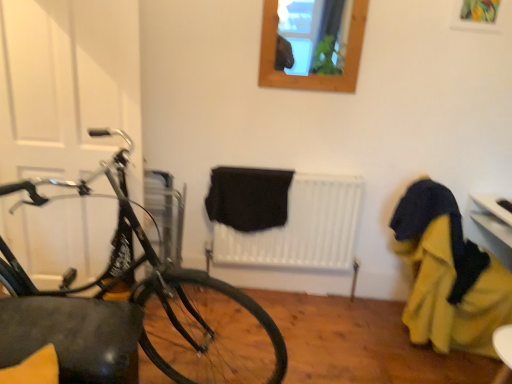
Question: From the image's perspective, is black matte radiator at center under wooden frame at upper center?

Choices:
 (A) no
 (B) yes

Answer: (B)

Question: From a real-world perspective, is black matte radiator at center under wooden frame at upper center?

Choices:
 (A) yes
 (B) no

Answer: (A)

Question: Can you confirm if black matte radiator at center is bigger than wooden frame at upper center?

Choices:
 (A) no
 (B) yes

Answer: (B)

Question: Does black matte radiator at center have a lesser height compared to wooden frame at upper center?

Choices:
 (A) yes
 (B) no

Answer: (B)

Question: Could you tell me if black matte radiator at center is turned towards wooden frame at upper center?

Choices:
 (A) yes
 (B) no

Answer: (B)

Question: Is wooden frame at upper center inside or outside of shiny black bicycle at left?

Choices:
 (A) outside
 (B) inside

Answer: (A)

Question: Based on their sizes in the image, would you say wooden frame at upper center is bigger or smaller than shiny black bicycle at left?

Choices:
 (A) small
 (B) big

Answer: (A)

Question: Is wooden frame at upper center taller or shorter than shiny black bicycle at left?

Choices:
 (A) tall
 (B) short

Answer: (B)

Question: Looking at their shapes, would you say wooden frame at upper center is wider or thinner than shiny black bicycle at left?

Choices:
 (A) thin
 (B) wide

Answer: (A)

Question: In the image, is white matte door at left positioned in front of or behind yellow fabric at right?

Choices:
 (A) front
 (B) behind

Answer: (A)

Question: Is point (89, 28) closer or farther from the camera than point (397, 238)?

Choices:
 (A) farther
 (B) closer

Answer: (B)

Question: Looking at their shapes, would you say white matte door at left is wider or thinner than yellow fabric at right?

Choices:
 (A) thin
 (B) wide

Answer: (A)

Question: In terms of height, does white matte door at left look taller or shorter compared to yellow fabric at right?

Choices:
 (A) short
 (B) tall

Answer: (B)

Question: Which is correct: white matte door at left is inside wooden frame at upper center, or outside of it?

Choices:
 (A) outside
 (B) inside

Answer: (A)

Question: Is point (121, 119) closer or farther from the camera than point (353, 26)?

Choices:
 (A) farther
 (B) closer

Answer: (B)